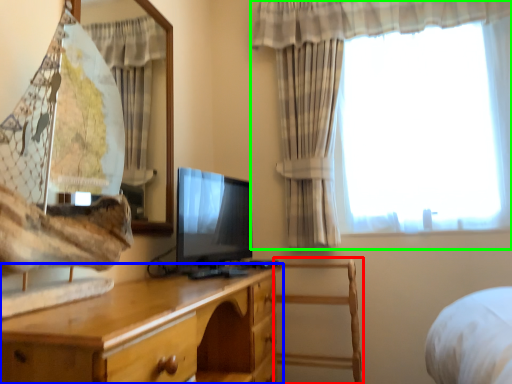
Question: Which object is positioned closest to chair (highlighted by a red box)? Select from chest of drawers (highlighted by a blue box) and curtain (highlighted by a green box).

Choices:
 (A) chest of drawers
 (B) curtain

Answer: (B)